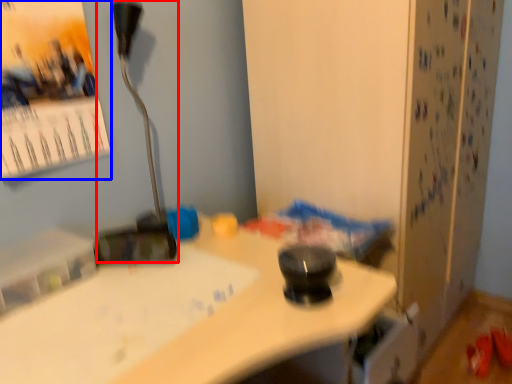
Question: Which point is further to the camera, lamp (highlighted by a red box) or poster page (highlighted by a blue box)?

Choices:
 (A) lamp
 (B) poster page

Answer: (A)